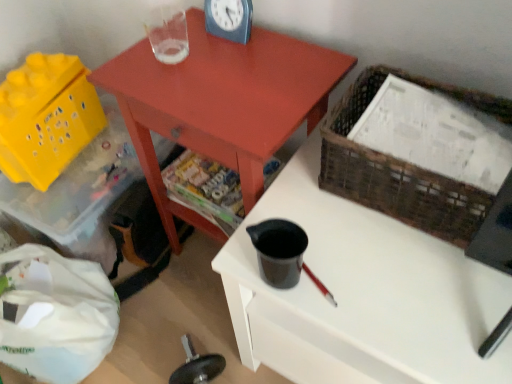
Find the location of a particular element. This screenshot has width=512, height=384. free location to the right of blue plastic clock at upper center is located at coordinates (283, 43).